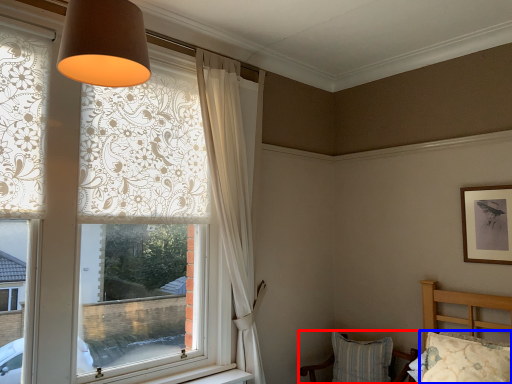
Question: Which object appears farthest to the camera in this image, chair (highlighted by a red box) or pillow (highlighted by a blue box)?

Choices:
 (A) chair
 (B) pillow

Answer: (A)